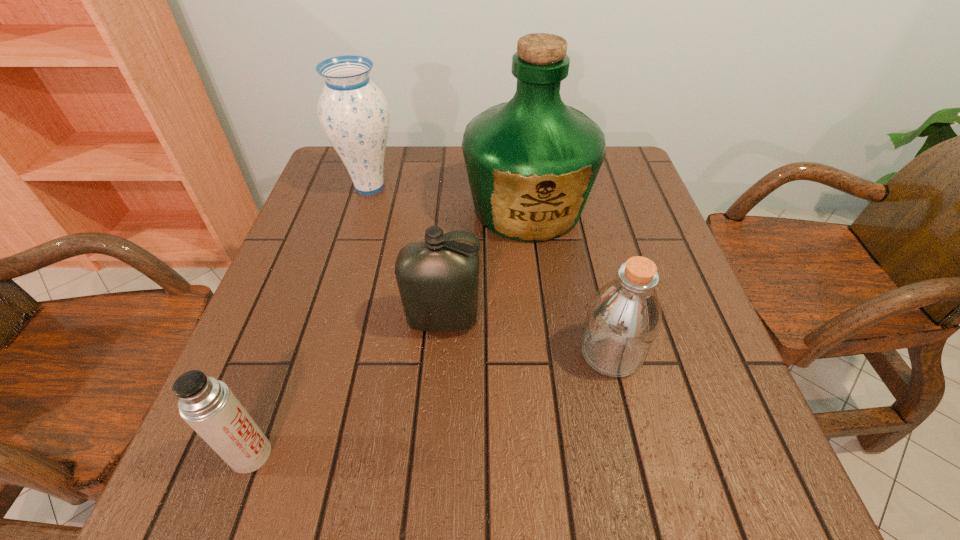
Image resolution: width=960 pixels, height=540 pixels. Identify the location of liquor. tap(531, 162).

I want to click on the second tallest object, so click(353, 111).

The image size is (960, 540). What are the coordinates of `the left bottle` in the screenshot? It's located at (438, 278).

At what (x,y) coordinates should I click in order to perform the action: click on the right bottle. Please return your answer as a coordinate pair (x, y). Looking at the image, I should click on pos(624,316).

Identify the location of the nearest object. Image resolution: width=960 pixels, height=540 pixels. (207, 405).

The width and height of the screenshot is (960, 540). Identify the location of free space located on the label side of the tallest object. pos(547,374).

Locate an element on the screen. The width and height of the screenshot is (960, 540). vacant space located 0.360m on the front of the fourth shortest object is located at coordinates (331, 316).

At what (x,y) coordinates should I click in order to perform the action: click on vacant space positioned on the back of the left bottle. Please return your answer as a coordinate pair (x, y). This screenshot has width=960, height=540. Looking at the image, I should click on pos(451,212).

Locate an element on the screen. This screenshot has height=540, width=960. vacant space situated 0.130m on the back of the right bottle is located at coordinates (592, 279).

I want to click on free space located on the right of the nearest object, so click(464, 454).